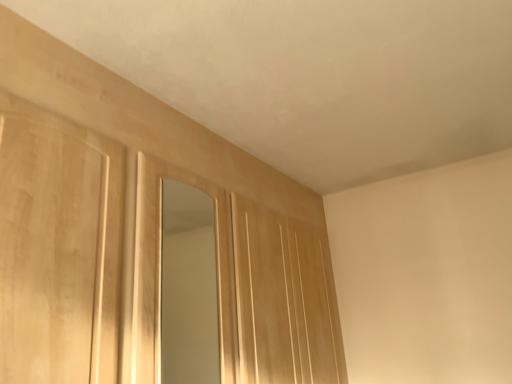
Question: Is light wood paneling at center in front of or behind light wood mirror at center in the image?

Choices:
 (A) front
 (B) behind

Answer: (B)

Question: Considering the positions of light wood paneling at center and light wood mirror at center in the image, is light wood paneling at center wider or thinner than light wood mirror at center?

Choices:
 (A) wide
 (B) thin

Answer: (A)

Question: From a real-world perspective, is light wood paneling at center physically located above or below light wood mirror at center?

Choices:
 (A) above
 (B) below

Answer: (B)

Question: Considering their positions, is light wood mirror at center located in front of or behind light wood paneling at center?

Choices:
 (A) behind
 (B) front

Answer: (B)

Question: Is point (206, 203) closer or farther from the camera than point (236, 213)?

Choices:
 (A) closer
 (B) farther

Answer: (B)

Question: Is light wood mirror at center situated inside light wood paneling at center or outside?

Choices:
 (A) inside
 (B) outside

Answer: (B)

Question: From the image's perspective, is light wood mirror at center above or below light wood paneling at center?

Choices:
 (A) above
 (B) below

Answer: (A)